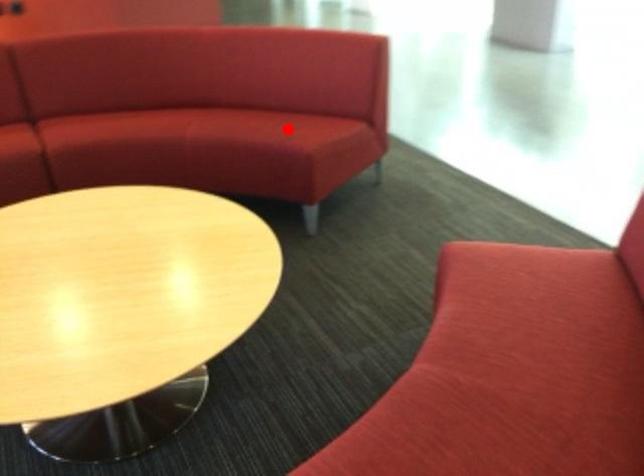
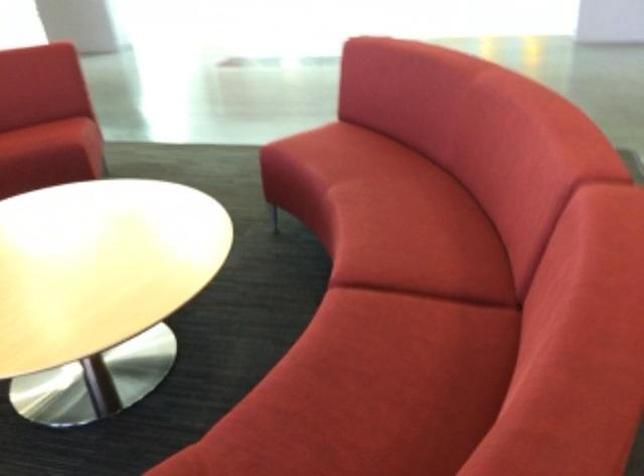
The point at the highlighted location is marked in the first image. Where is the corresponding point in the second image?

(46, 136)